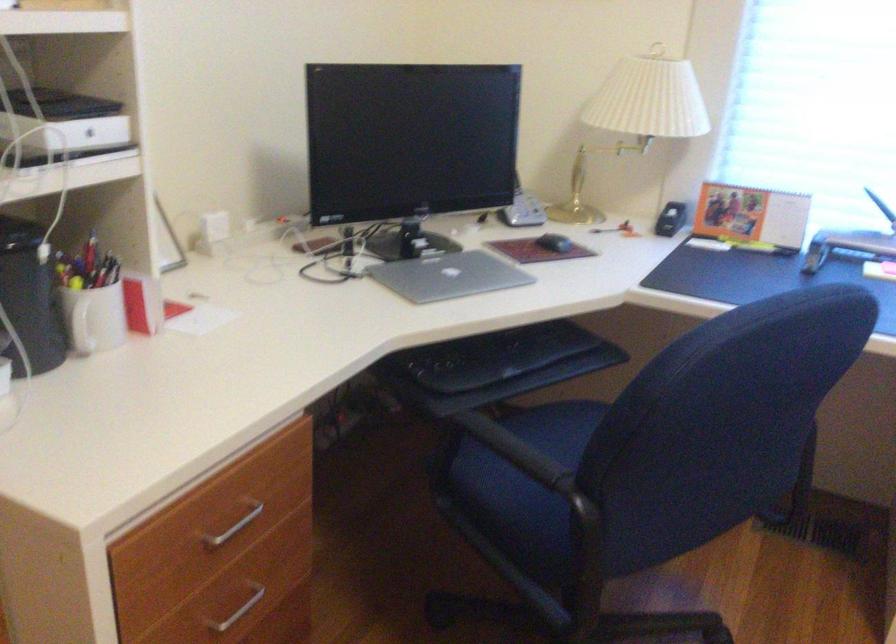
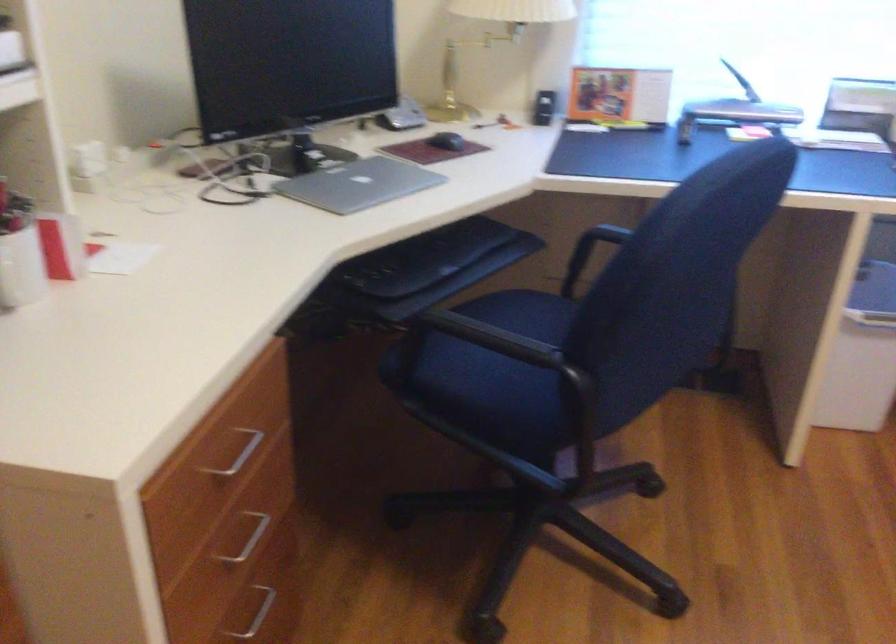
In the second image, find the point that corresponds to (x=552, y=243) in the first image.

(446, 140)